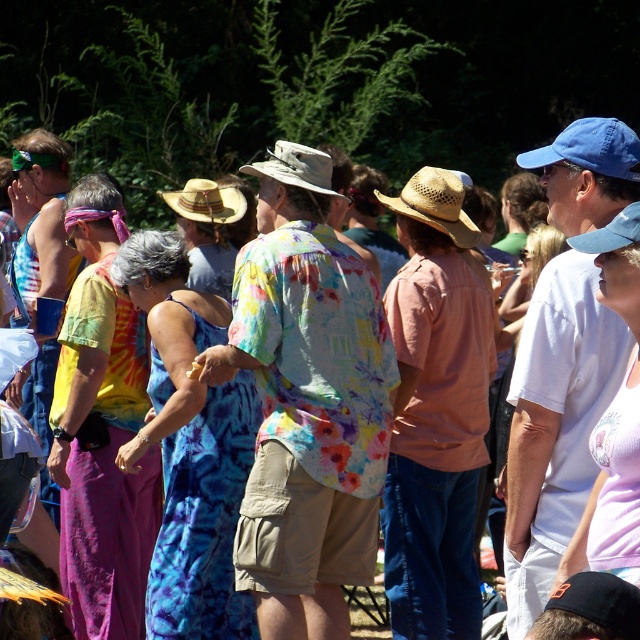
Question: Which point is farther to the camera?

Choices:
 (A) (273, 157)
 (B) (184, 208)

Answer: (B)

Question: Can you confirm if strawmaterial/texturecowboy hat at center is thinner than camouflage fabric cowboy hat at center?

Choices:
 (A) no
 (B) yes

Answer: (A)

Question: Can you confirm if camouflage fabric cowboy hat at center is wider than natural straw cowboy hat at center?

Choices:
 (A) yes
 (B) no

Answer: (B)

Question: Which of the following is the farthest from the observer?

Choices:
 (A) (193, 212)
 (B) (316, 150)
 (C) (440, 225)

Answer: (A)

Question: Which object is farther from the camera taking this photo?

Choices:
 (A) strawmaterial/texturecowboy hat at center
 (B) natural straw cowboy hat at center
 (C) camouflage fabric cowboy hat at center

Answer: (B)

Question: Where is strawmaterial/texturecowboy hat at center located in relation to natural straw cowboy hat at center in the image?

Choices:
 (A) left
 (B) right

Answer: (B)